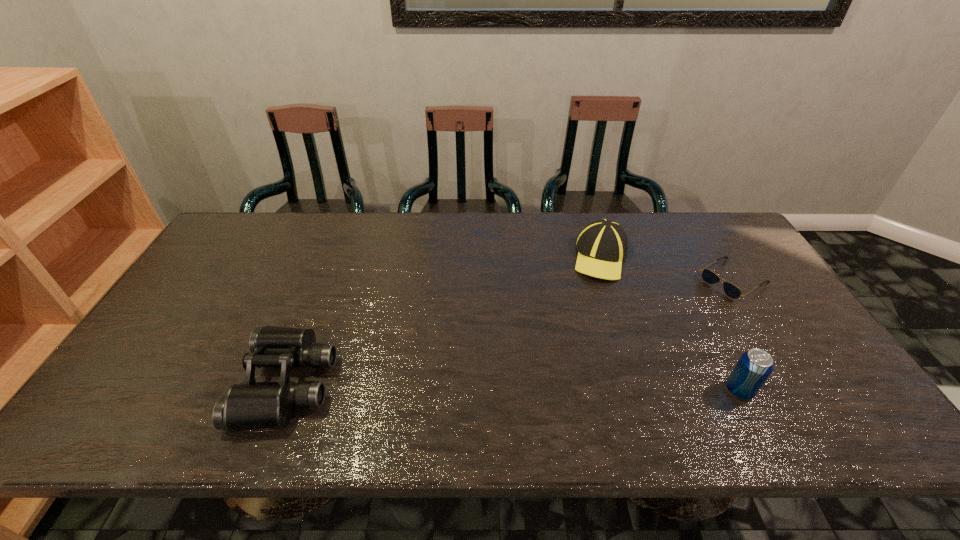
You are a GUI agent. You are given a task and a screenshot of the screen. Output one action in this format:
    pyautogui.click(x=<x>, y=<y>)
    Task: Click on the free point between the baseball cap and the leftmost object
    Image resolution: width=960 pixels, height=540 pixels.
    Given the screenshot: What is the action you would take?
    pyautogui.click(x=444, y=320)

The height and width of the screenshot is (540, 960). I want to click on vacant area that lies between the beer can and the second object from left to right, so click(670, 323).

You are a GUI agent. You are given a task and a screenshot of the screen. Output one action in this format:
    pyautogui.click(x=<x>, y=<y>)
    Task: Click on the empty location between the third object from left to right and the baseball cap
    The height and width of the screenshot is (540, 960).
    Given the screenshot: What is the action you would take?
    pyautogui.click(x=670, y=323)

Identify the location of object that is the closest to the shortest object. The width and height of the screenshot is (960, 540). (602, 245).

The height and width of the screenshot is (540, 960). I want to click on object that is the closest one to the beer can, so pyautogui.click(x=732, y=291).

Where is `free location that satisfies the following two spatial constraints: 1. on the back side of the beer can; 2. on the right side of the sunglasses`? free location that satisfies the following two spatial constraints: 1. on the back side of the beer can; 2. on the right side of the sunglasses is located at coordinates (684, 280).

The image size is (960, 540). I want to click on blank area in the image that satisfies the following two spatial constraints: 1. on the front side of the second object from left to right; 2. on the right side of the sunglasses, so click(x=608, y=280).

Identify the location of free spot that satisfies the following two spatial constraints: 1. on the front side of the shortest object; 2. on the right side of the baseball cap. The image size is (960, 540). (608, 280).